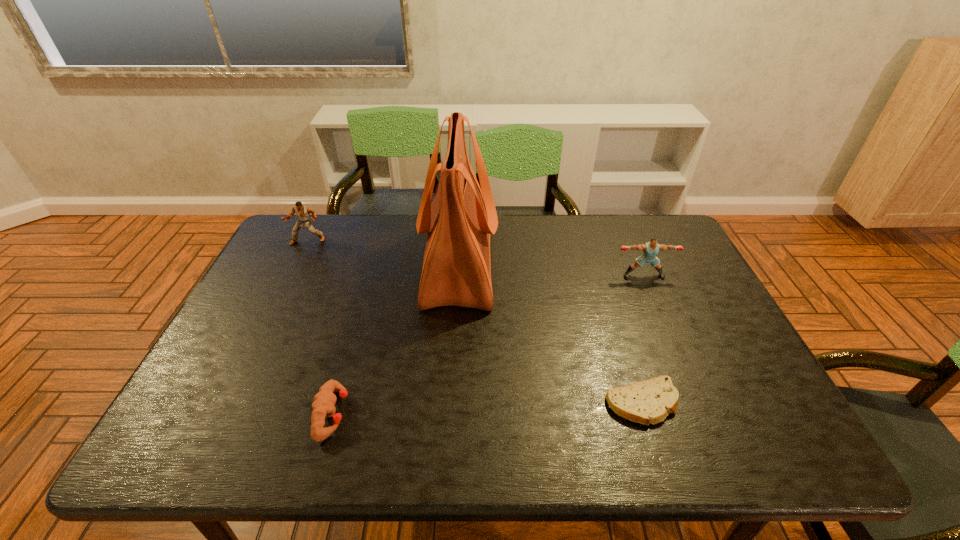
At what (x,y) coordinates should I click in order to perform the action: click on free space located on the front-facing side of the second nearest puncher. Please return your answer as a coordinate pair (x, y). The width and height of the screenshot is (960, 540). Looking at the image, I should click on (660, 316).

You are a GUI agent. You are given a task and a screenshot of the screen. Output one action in this format:
    pyautogui.click(x=<x>, y=<y>)
    Task: Click on the free space located with the gloves of the nearest puncher facing forward
    The height and width of the screenshot is (540, 960).
    Given the screenshot: What is the action you would take?
    pyautogui.click(x=492, y=414)

At what (x,y) coordinates should I click in order to perform the action: click on free space located on the right of the pita bread. Please return your answer as a coordinate pair (x, y). This screenshot has height=540, width=960. Looking at the image, I should click on (777, 403).

The image size is (960, 540). Identify the location of shopping bag present at the far edge. (456, 271).

The height and width of the screenshot is (540, 960). I want to click on puncher positioned at the far edge, so click(x=303, y=212).

Where is `puncher at the near edge`? puncher at the near edge is located at coordinates (323, 406).

What are the coordinates of `pita bread that is at the near edge` in the screenshot? It's located at (649, 401).

You are a GUI agent. You are given a task and a screenshot of the screen. Output one action in this format:
    pyautogui.click(x=<x>, y=<y>)
    Task: Click on the object present at the left edge
    The width and height of the screenshot is (960, 540).
    Given the screenshot: What is the action you would take?
    pyautogui.click(x=303, y=212)

Locate an element on the screen. The width and height of the screenshot is (960, 540). object present at the right edge is located at coordinates (650, 249).

The height and width of the screenshot is (540, 960). I want to click on object that is at the far left corner, so click(303, 212).